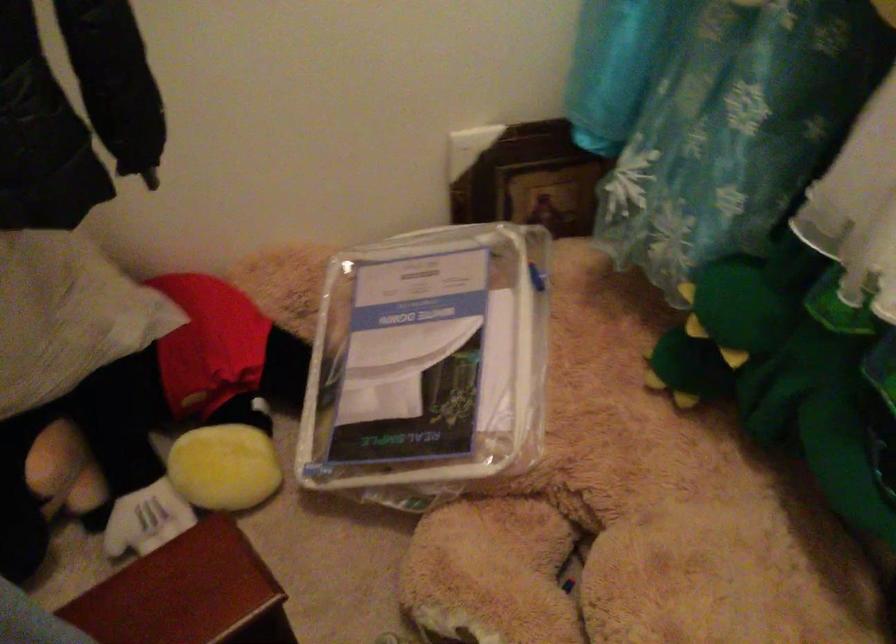
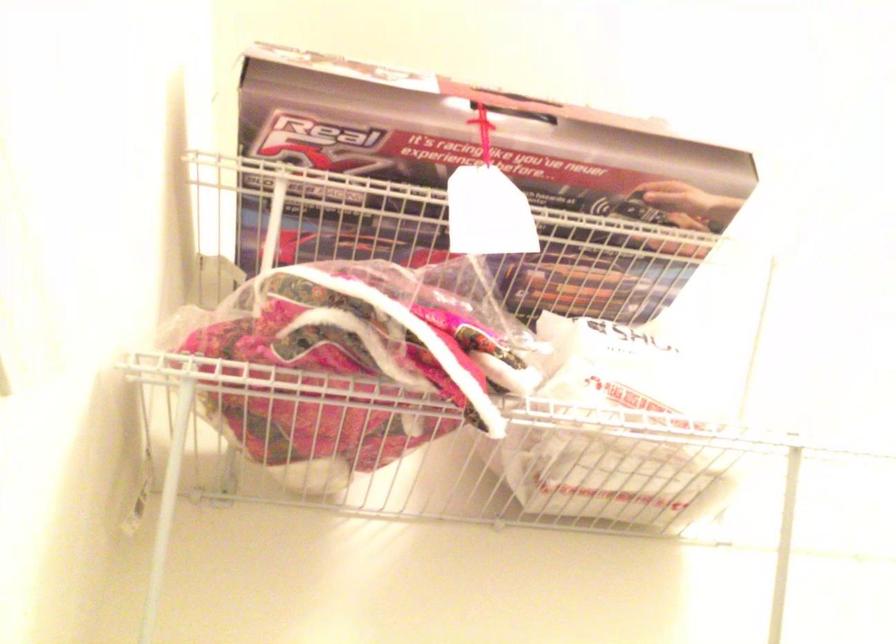
First-person continuous shooting, in which direction is the camera rotating?

The rotation direction of the camera is left-up.